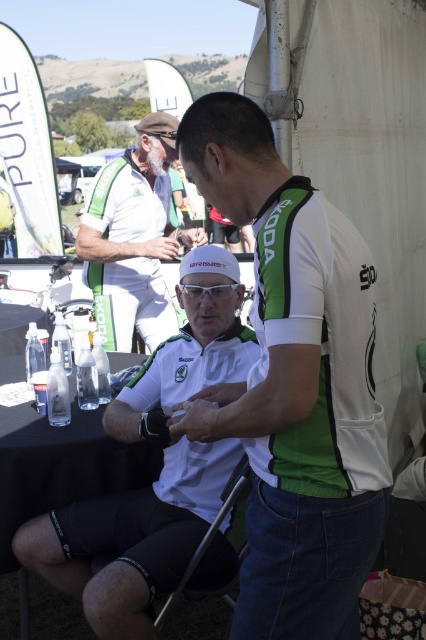
You are a photographer at the cycling event and need to capture a photo of both the white matte cycling jersey at center and the black fabric folding chair at lower center. Since you want to ensure both are visible in the frame, can you determine if the jersey is positioned higher than the chair?

The white matte cycling jersey at center is above the black fabric folding chair at lower center, so yes, the jersey is positioned higher and will be visible in the frame along with the chair.

You are a photographer at the cycling event. You need to capture a photo that includes both the white matte jersey at center and the black fabric table at lower center. Given their sizes, which object should you focus on first to ensure both are in the frame?

The white matte jersey at center is much taller than the black fabric table at lower center, so you should focus on the white matte jersey at center first to ensure both fit in the frame.